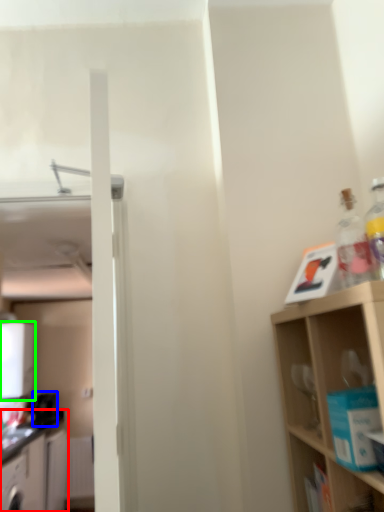
Question: Which object is the closest to the cabinetry (highlighted by a red box)? Choose among these: appliance (highlighted by a blue box) or appliance (highlighted by a green box).

Choices:
 (A) appliance
 (B) appliance

Answer: (A)